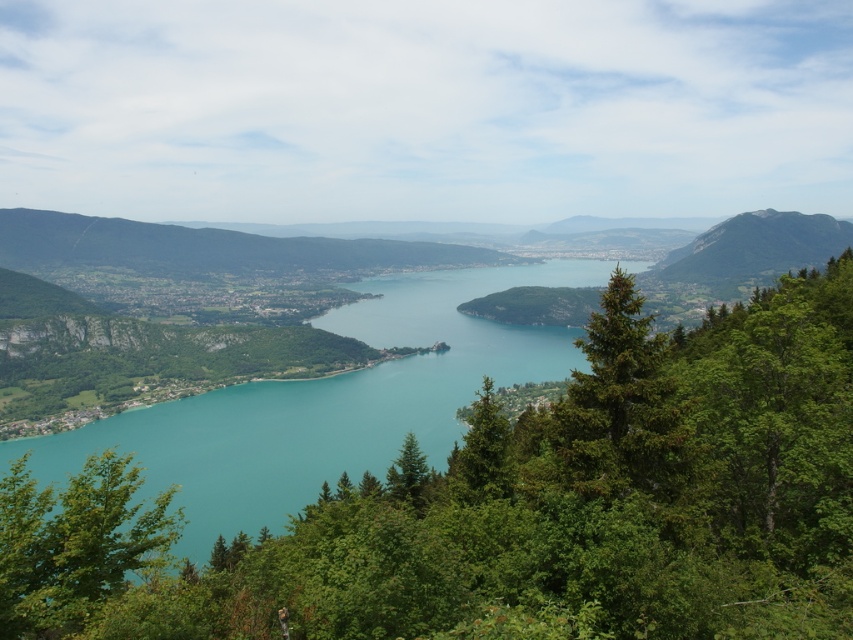
Question: Which point is farther to the camera?

Choices:
 (A) green leafy tree at center
 (B) green leafy tree at lower left

Answer: (B)

Question: Can you confirm if green leafy tree at lower left is wider than green needle-like tree at center-right?

Choices:
 (A) no
 (B) yes

Answer: (B)

Question: Among these objects, which one is nearest to the camera?

Choices:
 (A) green leafy tree at lower left
 (B) green needle-like tree at center-right
 (C) green leafy tree at center

Answer: (C)

Question: Is green leafy tree at center positioned in front of green leafy tree at lower left?

Choices:
 (A) yes
 (B) no

Answer: (A)

Question: Does green leafy tree at center appear under green leafy tree at lower left?

Choices:
 (A) no
 (B) yes

Answer: (A)

Question: Which object is positioned farthest from the green leafy tree at center?

Choices:
 (A) green leafy tree at lower left
 (B) green needle-like tree at center-right

Answer: (A)